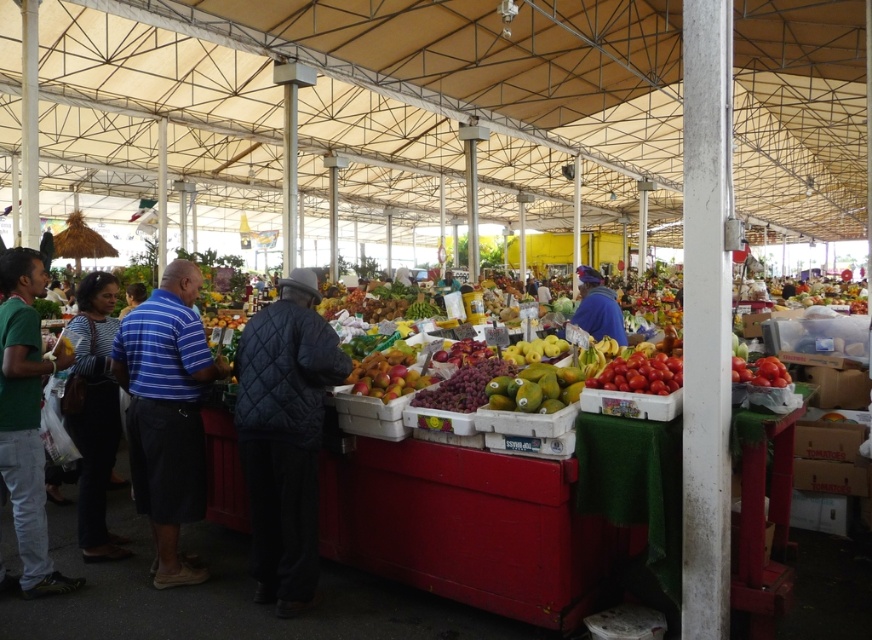
Question: Which of the following is the closest to the observer?

Choices:
 (A) (284, 353)
 (B) (382, 397)
 (C) (106, 276)
 (D) (142, 326)

Answer: (A)

Question: In this image, where is blue striped shirt at center located relative to glossy red apples at center?

Choices:
 (A) right
 (B) left

Answer: (B)

Question: Which point appears farthest from the camera in this image?

Choices:
 (A) (181, 284)
 (B) (46, 557)
 (C) (545, 381)

Answer: (A)

Question: From the image, what is the correct spatial relationship of blue striped shirt at center in relation to glossy red apples at center?

Choices:
 (A) left
 (B) right

Answer: (A)

Question: Is yellow matte mangoes at center wider than shiny red tomatoes at right?

Choices:
 (A) yes
 (B) no

Answer: (A)

Question: Which is farther from the blue quilted jacket at center?

Choices:
 (A) blue striped shirt at center
 (B) red matte tomatoes at right
 (C) shiny red tomatoes at right
 (D) green matte shirt at left

Answer: (D)